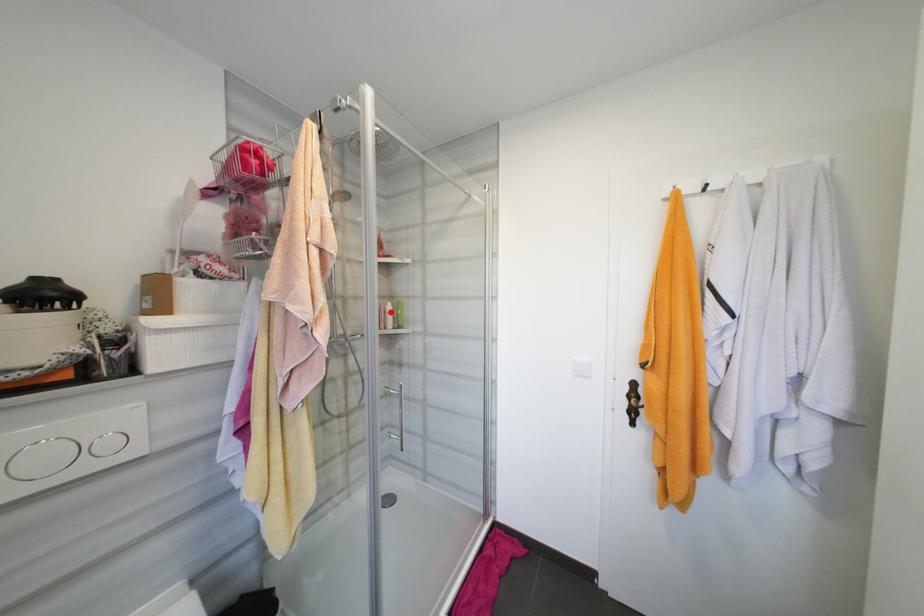
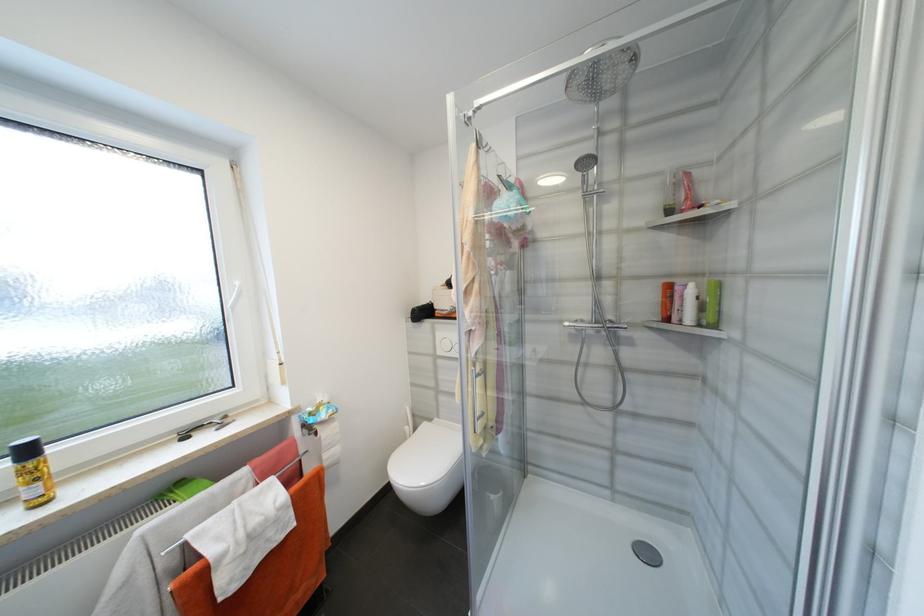
Where in the second image is the point corresponding to the highlighted location from the first image?

(687, 297)